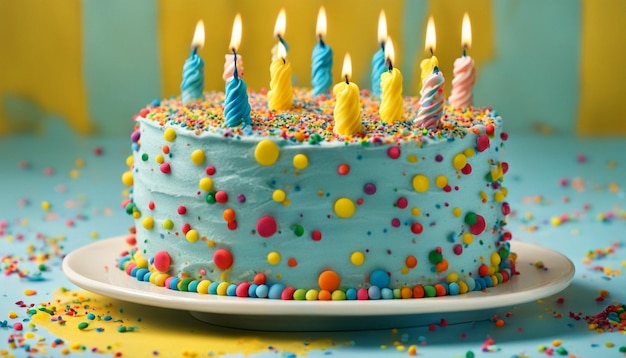
Find the location of a particular element. yellow birthday candles is located at coordinates (274, 81), (277, 54), (345, 109), (390, 94), (429, 66).